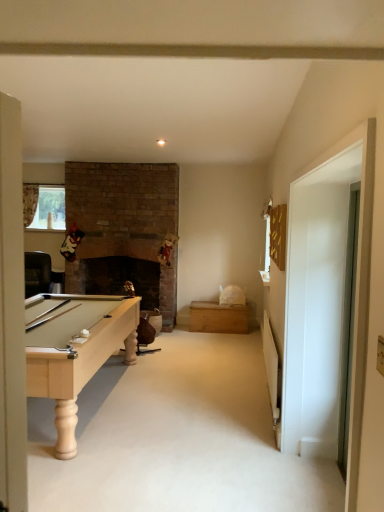
Question: Based on their positions, is clear glass window at upper left located to the left or right of wooden chest at center?

Choices:
 (A) left
 (B) right

Answer: (A)

Question: Does point (59, 215) appear closer or farther from the camera than point (246, 325)?

Choices:
 (A) closer
 (B) farther

Answer: (B)

Question: Which of these objects is positioned closest to the clear glass window at upper left?

Choices:
 (A) wooden chest at center
 (B) transparent glass door at right, which appears as the 1th glass door when viewed from the right
 (C) white glossy door at right, the 2th glass door positioned from the right

Answer: (A)

Question: Considering the real-world distances, which object is farthest from the clear glass window at upper left?

Choices:
 (A) transparent glass door at right, the 2th glass door viewed from the left
 (B) wooden chest at center
 (C) white glossy door at right, placed as the first glass door when sorted from left to right

Answer: (A)